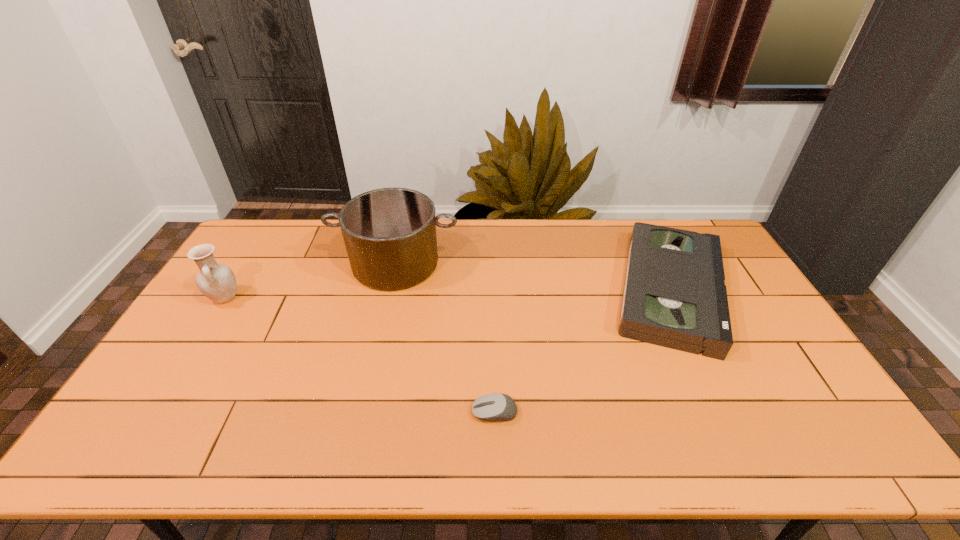
Identify the location of object that is the second closest to the pan. (495, 406).

Choose which object is the second nearest neighbor to the pottery. Please provide its 2D coordinates. Your answer should be formatted as a tuple, i.e. [(x, y)], where the tuple contains the x and y coordinates of a point satisfying the conditions above.

[(495, 406)]

At what (x,y) coordinates should I click in order to perform the action: click on vacant space that satisfies the following two spatial constraints: 1. on the back side of the pan; 2. on the left side of the pottery. Please return your answer as a coordinate pair (x, y). The width and height of the screenshot is (960, 540). Looking at the image, I should click on (247, 264).